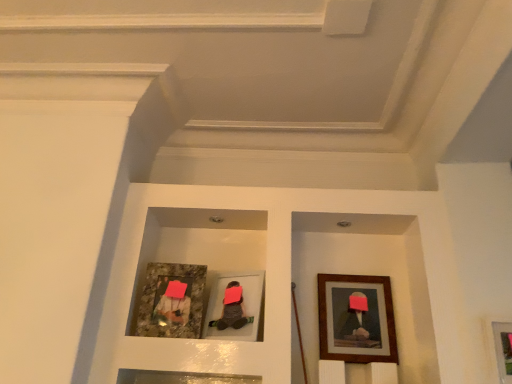
Question: Can you confirm if matte gray picture frame at center, the third picture frame from the right, is positioned to the left of granite-like frame at left, arranged as the 1th picture frame when viewed from the left?

Choices:
 (A) yes
 (B) no

Answer: (B)

Question: Does matte gray picture frame at center, the third picture frame from the right, have a greater height compared to granite-like frame at left, arranged as the 1th picture frame when viewed from the left?

Choices:
 (A) yes
 (B) no

Answer: (B)

Question: From a real-world perspective, is matte gray picture frame at center, the third picture frame from the right, below granite-like frame at left, arranged as the 1th picture frame when viewed from the left?

Choices:
 (A) no
 (B) yes

Answer: (B)

Question: Can you confirm if matte gray picture frame at center, positioned as the second picture frame in left-to-right order, is smaller than granite-like frame at left, placed as the fourth picture frame when sorted from right to left?

Choices:
 (A) yes
 (B) no

Answer: (B)

Question: Is matte gray picture frame at center, positioned as the second picture frame in left-to-right order, outside granite-like frame at left, placed as the fourth picture frame when sorted from right to left?

Choices:
 (A) yes
 (B) no

Answer: (A)

Question: Considering the relative sizes of matte gray picture frame at center, positioned as the second picture frame in left-to-right order, and granite-like frame at left, arranged as the 1th picture frame when viewed from the left, in the image provided, is matte gray picture frame at center, positioned as the second picture frame in left-to-right order, shorter than granite-like frame at left, arranged as the 1th picture frame when viewed from the left,?

Choices:
 (A) yes
 (B) no

Answer: (A)

Question: Considering the relative positions of wooden framed picture at lower right, the 4th picture frame from the left, and wooden framed artwork at right, which is the 2th picture frame in right-to-left order, in the image provided, is wooden framed picture at lower right, the 4th picture frame from the left, to the right of wooden framed artwork at right, which is the 2th picture frame in right-to-left order, from the viewer's perspective?

Choices:
 (A) yes
 (B) no

Answer: (A)

Question: From the image's perspective, would you say wooden framed picture at lower right, the 4th picture frame from the left, is shown under wooden framed artwork at right, which is the 2th picture frame in right-to-left order?

Choices:
 (A) yes
 (B) no

Answer: (A)

Question: Is wooden framed picture at lower right, which is the 1th picture frame from right to left, further to camera compared to wooden framed artwork at right, the 3th picture frame in the left-to-right sequence?

Choices:
 (A) no
 (B) yes

Answer: (A)

Question: Is wooden framed artwork at right, which is the 2th picture frame in right-to-left order, completely or partially inside wooden framed picture at lower right, which is the 1th picture frame from right to left?

Choices:
 (A) yes
 (B) no

Answer: (B)

Question: Does wooden framed picture at lower right, which is the 1th picture frame from right to left, appear on the left side of wooden framed artwork at right, which is the 2th picture frame in right-to-left order?

Choices:
 (A) yes
 (B) no

Answer: (B)

Question: From a real-world perspective, is wooden framed picture at lower right, which is the 1th picture frame from right to left, over wooden framed artwork at right, the 3th picture frame in the left-to-right sequence?

Choices:
 (A) yes
 (B) no

Answer: (B)

Question: Is wooden framed picture at lower right, which is the 1th picture frame from right to left, oriented away from matte gray picture frame at center, the third picture frame from the right?

Choices:
 (A) yes
 (B) no

Answer: (B)